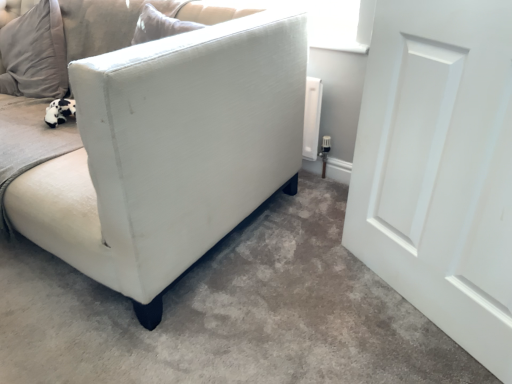
The image size is (512, 384). I want to click on white matte door at right, so click(440, 168).

What is the approximate width of white fabric sofa at lower left?

It is 5.52 feet.

Find the location of a particular element. Image resolution: width=512 pixels, height=384 pixels. white fabric couch at left is located at coordinates (170, 152).

Would you say white fabric sofa at lower left is part of white matte door at right's contents?

No, white fabric sofa at lower left is located outside of white matte door at right.

From the image's perspective, which one is positioned higher, white matte door at right or white fabric sofa at lower left?

white matte door at right.

Looking at their sizes, would you say white matte door at right is wider or thinner than white fabric sofa at lower left?

white matte door at right is thinner than white fabric sofa at lower left.

Considering the relative sizes of white matte door at right and white fabric sofa at lower left in the image provided, is white matte door at right smaller than white fabric sofa at lower left?

Correct, white matte door at right occupies less space than white fabric sofa at lower left.

Is white fabric couch at left spatially inside white matte door at right, or outside of it?

white fabric couch at left is not inside white matte door at right, it's outside.

Is white fabric couch at left positioned with its back to white matte door at right?

white fabric couch at left does not have its back to white matte door at right.

Considering the relative sizes of white fabric couch at left and white matte door at right in the image provided, is white fabric couch at left taller than white matte door at right?

In fact, white fabric couch at left may be shorter than white matte door at right.

I want to click on door lying on the right of white fabric couch at left, so click(x=440, y=168).

Is white fabric couch at left in front of or behind white fabric sofa at lower left in the image?

Visually, white fabric couch at left is located behind white fabric sofa at lower left.

Considering the positions of objects white fabric couch at left and white fabric sofa at lower left in the image provided, who is more to the right, white fabric couch at left or white fabric sofa at lower left?

white fabric sofa at lower left.

Is white fabric couch at left placed right next to white fabric sofa at lower left?

There is a gap between white fabric couch at left and white fabric sofa at lower left.

From the image's perspective, which is above, white fabric sofa at lower left or white fabric couch at left?

From the image's view, white fabric couch at left is above.

Is white fabric sofa at lower left far from white fabric couch at left?

white fabric sofa at lower left is actually quite close to white fabric couch at left.

Based on the photo, from a real-world perspective, which is physically above, white fabric sofa at lower left or white fabric couch at left?

In real-world perspective, white fabric couch at left is above.

Is white fabric sofa at lower left inside the boundaries of white fabric couch at left, or outside?

white fabric sofa at lower left lies outside white fabric couch at left.

Which object is positioned more to the left, white fabric sofa at lower left or white matte door at right?

white fabric sofa at lower left is more to the left.

Considering the relative sizes of white fabric sofa at lower left and white matte door at right in the image provided, is white fabric sofa at lower left smaller than white matte door at right?

No, white fabric sofa at lower left is not smaller than white matte door at right.

Can you tell me how much white fabric sofa at lower left and white matte door at right differ in facing direction?

116 degrees.

Is white fabric sofa at lower left outside of white matte door at right?

Yes, white fabric sofa at lower left is outside of white matte door at right.

Considering the sizes of objects white matte door at right and white fabric couch at left in the image provided, who is shorter, white matte door at right or white fabric couch at left?

white fabric couch at left is shorter.

From the picture: How different are the orientations of white matte door at right and white fabric couch at left in degrees?

white matte door at right and white fabric couch at left are facing 25.1 degrees away from each other.

Between white matte door at right and white fabric couch at left, which one has smaller size?

With smaller size is white matte door at right.

Is white matte door at right with white fabric couch at left?

There is a gap between white matte door at right and white fabric couch at left.

This screenshot has width=512, height=384. I want to click on concrete below the white matte door at right (from a real-world perspective), so click(229, 313).

The width and height of the screenshot is (512, 384). What are the coordinates of `studio couch lying on the left of white matte door at right` in the screenshot? It's located at (170, 152).

Considering their positions, is white fabric sofa at lower left positioned closer to white fabric couch at left than white matte door at right?

white fabric sofa at lower left.

Based on their spatial positions, is white matte door at right or white fabric sofa at lower left further from white fabric couch at left?

white matte door at right is positioned further to the anchor white fabric couch at left.

Estimate the real-world distances between objects in this image. Which object is further from white matte door at right, white fabric couch at left or white fabric sofa at lower left?

Based on the image, white fabric couch at left appears to be further to white matte door at right.

Estimate the real-world distances between objects in this image. Which object is closer to white fabric sofa at lower left, white fabric couch at left or white matte door at right?

Among the two, white fabric couch at left is located nearer to white fabric sofa at lower left.

Looking at this image, which object lies further to the anchor point white matte door at right, white fabric sofa at lower left or white fabric couch at left?

white fabric couch at left is positioned further to the anchor white matte door at right.

From the image, which object appears to be nearer to white fabric sofa at lower left, white matte door at right or white fabric couch at left?

Based on the image, white fabric couch at left appears to be nearer to white fabric sofa at lower left.

This screenshot has width=512, height=384. Identify the location of concrete between white fabric couch at left and white matte door at right. (229, 313).